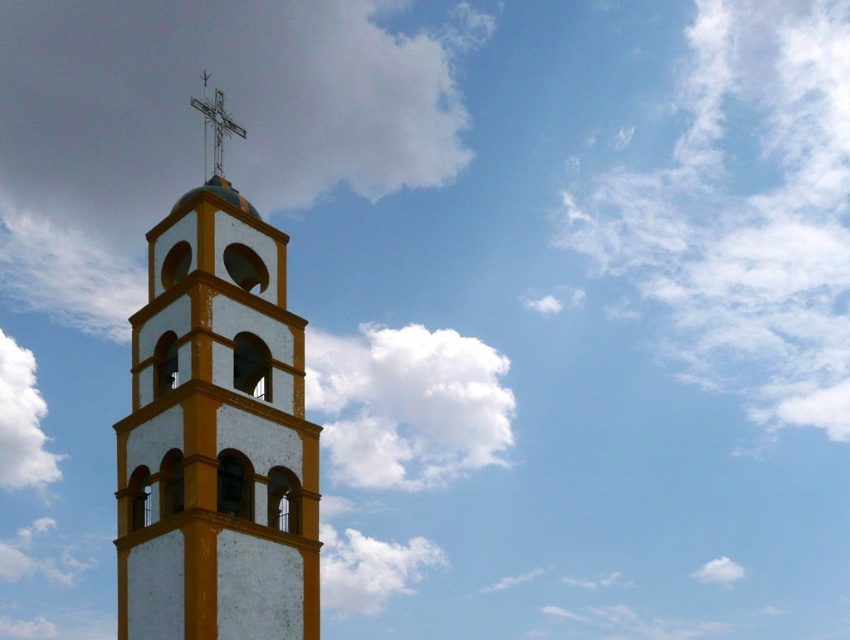
You are standing in a field looking at the white painted stone bell tower at left and the white fluffy cloud at upper center. Which object is higher in the sky?

The white painted stone bell tower at left is located above the white fluffy cloud at upper center, so the bell tower is higher in the sky than the cloud.

From the picture: You are standing in front of the bell tower and want to determine the relative positions of two points marked on the tower. Which point is closer to you, point (258,630) or point (354,579)?

Point (258,630) is closer to the viewer than point (354,579) according to the description.

You are standing in front of the bell tower and looking up. You notice the white fluffy cloud at upper left and the metallic cross at upper center. Which object is positioned higher in the sky?

Result: The white fluffy cloud at upper left is much taller than the metallic cross at upper center, so the white fluffy cloud at upper left is positioned higher in the sky.